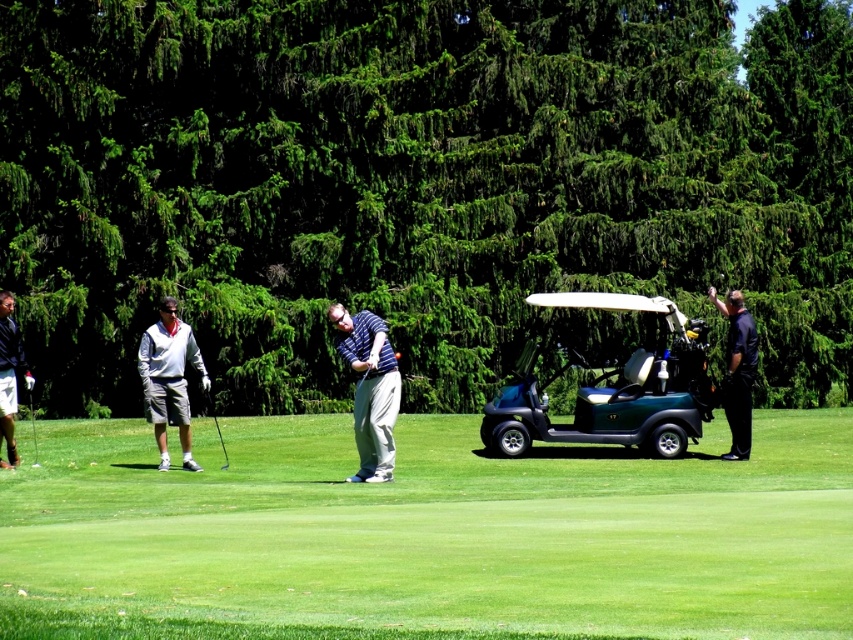
Question: Does green grass at center have a smaller size compared to striped cotton shirt at center?

Choices:
 (A) no
 (B) yes

Answer: (A)

Question: Considering the real-world distances, which object is farthest from the metallic silver golf club at lower left?

Choices:
 (A) green grass at center
 (B) black smooth golf club at right

Answer: (B)

Question: Can you confirm if striped cotton shirt at center is thinner than metallic silver golf club at lower left?

Choices:
 (A) yes
 (B) no

Answer: (A)

Question: Where is green grass at center located in relation to striped cotton shirt at center in the image?

Choices:
 (A) left
 (B) right

Answer: (A)

Question: Which of the following is the closest to the observer?

Choices:
 (A) (x=335, y=340)
 (B) (x=630, y=438)

Answer: (B)

Question: Among these points, which one is nearest to the camera?

Choices:
 (A) (740, 428)
 (B) (634, 595)

Answer: (B)